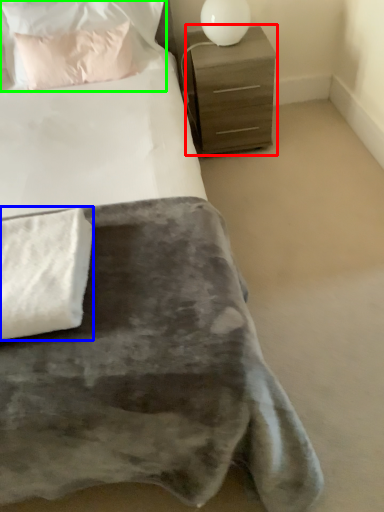
Question: Estimate the real-world distances between objects in this image. Which object is farther from chest of drawers (highlighted by a red box), blanket (highlighted by a blue box) or pillow (highlighted by a green box)?

Choices:
 (A) blanket
 (B) pillow

Answer: (A)